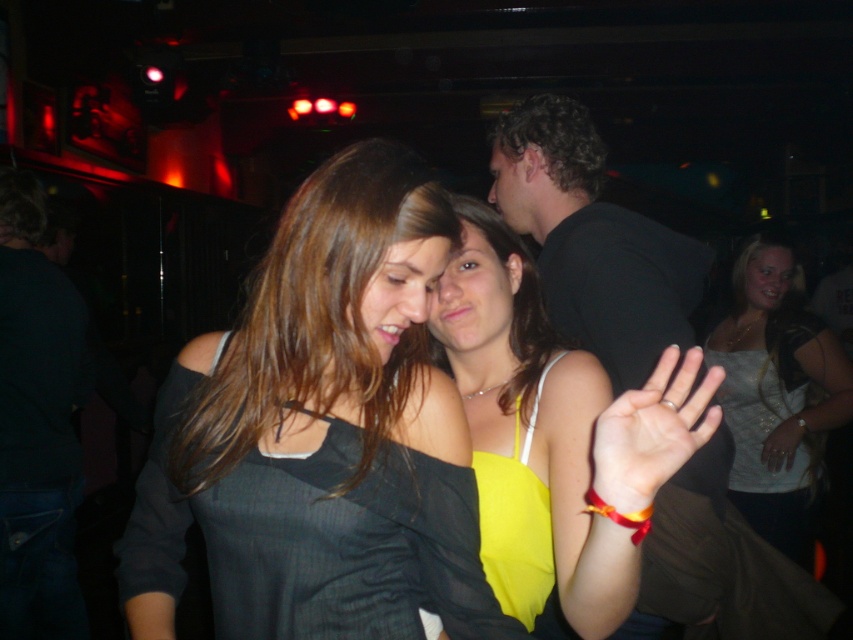
You are a photographer at the event and want to capture both the matte black dress at center and the yellow satin tank top at center in a single frame. Which of the two clothing items will appear taller in the photo?

The yellow satin tank top at center appears taller than the matte black dress at center in the photo because the matte black dress at center is not as tall as the yellow satin tank top at center.

You are a photographer trying to capture a clear shot of both the smooth yellow fabric at center and the metallic silver ring at center. Since you want both objects in focus, which one should you adjust your camera focus on first?

The smooth yellow fabric at center is in front of the metallic silver ring at center, so you should focus on the smooth yellow fabric at center first to ensure both are in focus.

You are a photographer at the event and want to capture a photo where the smooth yellow fabric at center and the metallic silver ring at center are both visible. Based on their positions, which object should appear higher in the photo?

The smooth yellow fabric at center is positioned above the metallic silver ring at center, so it will appear higher in the photo.